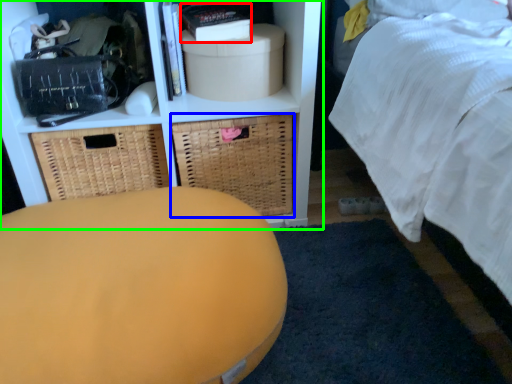
Question: Considering the real-world distances, which object is closest to book (highlighted by a red box)? basket (highlighted by a blue box) or shelf (highlighted by a green box).

Choices:
 (A) basket
 (B) shelf

Answer: (B)